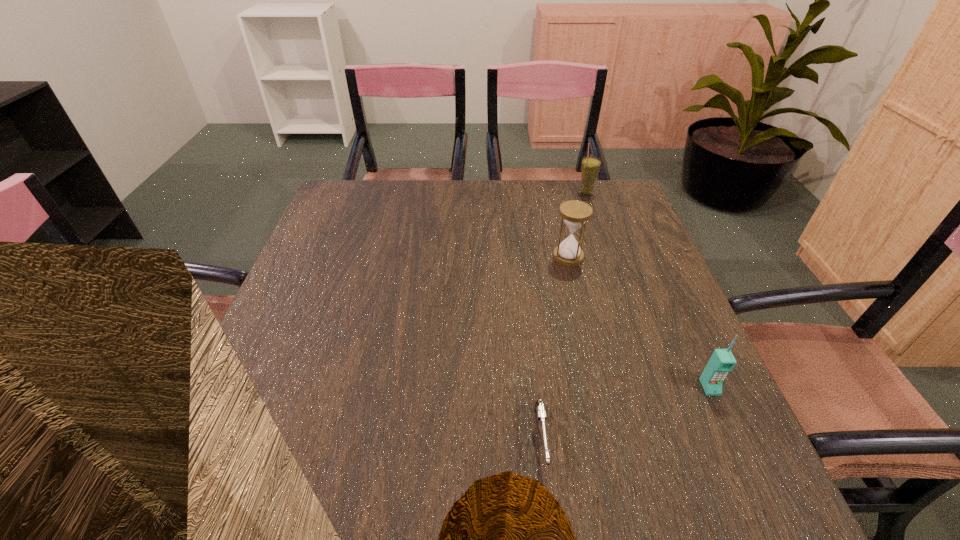
Identify the location of vacant space at the far left corner of the desktop. The image size is (960, 540). (336, 191).

Locate an element on the screen. The image size is (960, 540). blank area at the near left corner is located at coordinates (270, 472).

At what (x,y) coordinates should I click in order to perform the action: click on free space between the rightmost object and the third nearest object. Please return your answer as a coordinate pair (x, y). Looking at the image, I should click on (638, 322).

Locate an element on the screen. The image size is (960, 540). blank region between the second farthest object and the pistol is located at coordinates (555, 348).

Locate an element on the screen. free space between the third farthest object and the farthest object is located at coordinates (648, 290).

Image resolution: width=960 pixels, height=540 pixels. I want to click on free space between the cellular telephone and the second object from left to right, so click(638, 322).

Identify the location of free space between the hourglass and the nearest object. (555, 348).

Locate an element on the screen. The height and width of the screenshot is (540, 960). free space between the shortest object and the rightmost object is located at coordinates click(625, 413).

The height and width of the screenshot is (540, 960). What are the coordinates of `unoccupied position between the pistol and the third farthest object` in the screenshot? It's located at (625, 413).

Locate an element on the screen. This screenshot has width=960, height=540. object that stands as the third closest to the straw for drinking is located at coordinates (540, 409).